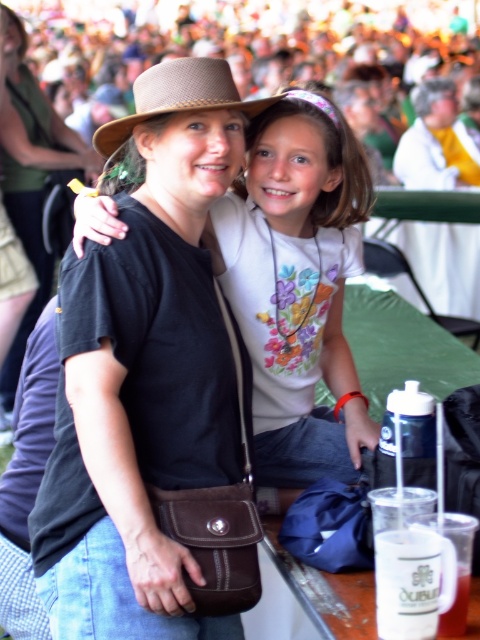
Is matte brown hat at center above brown woven cowboy hat at center?

Actually, matte brown hat at center is below brown woven cowboy hat at center.

Is point (338, 442) closer to camera compared to point (227, 77)?

No, it is not.

This screenshot has width=480, height=640. I want to click on matte brown hat at center, so click(298, 285).

Who is higher up, matte black shirt at center or brown woven cowboy hat at center?

Positioned higher is matte black shirt at center.

Is matte black shirt at center thinner than brown woven cowboy hat at center?

Correct, matte black shirt at center's width is less than brown woven cowboy hat at center's.

Between point (33, 144) and point (141, 80), which one is positioned in front?

Positioned in front is point (141, 80).

Where is `matte black shirt at center`? The height and width of the screenshot is (640, 480). matte black shirt at center is located at coordinates pos(31,177).

Based on the photo, who is lower down, matte brown hat at center or matte black shirt at center?

matte brown hat at center is lower down.

Who is more distant from viewer, (211, 214) or (69, 129)?

Point (69, 129)

Who is more forward, (301, 157) or (19, 184)?

Point (301, 157) is in front.

Where is `matte brown hat at center`? This screenshot has width=480, height=640. matte brown hat at center is located at coordinates (298, 285).